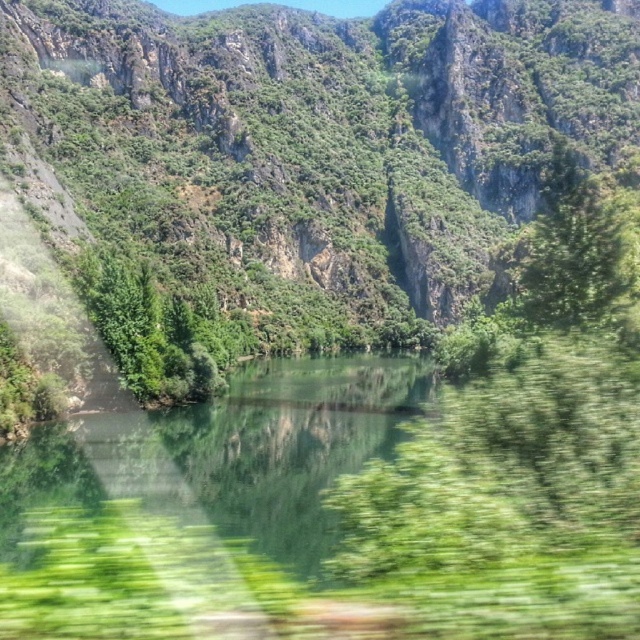
Question: Is green rocky mountain at center positioned before green leafy tree at upper right?

Choices:
 (A) yes
 (B) no

Answer: (B)

Question: Which point appears closest to the camera in this image?

Choices:
 (A) (122, 282)
 (B) (529, 308)
 (C) (323, 156)

Answer: (B)

Question: From the image, what is the correct spatial relationship of green rocky mountain at center in relation to green leafy tree at center-left?

Choices:
 (A) left
 (B) right

Answer: (B)

Question: Which object is the closest to the green rocky mountain at center?

Choices:
 (A) green leafy tree at upper right
 (B) green leafy tree at center-left

Answer: (A)

Question: Which object appears farthest from the camera in this image?

Choices:
 (A) green leafy tree at center-left
 (B) green leafy tree at upper right
 (C) green rocky mountain at center

Answer: (C)

Question: Is green leafy tree at center-left behind green leafy tree at upper right?

Choices:
 (A) no
 (B) yes

Answer: (B)